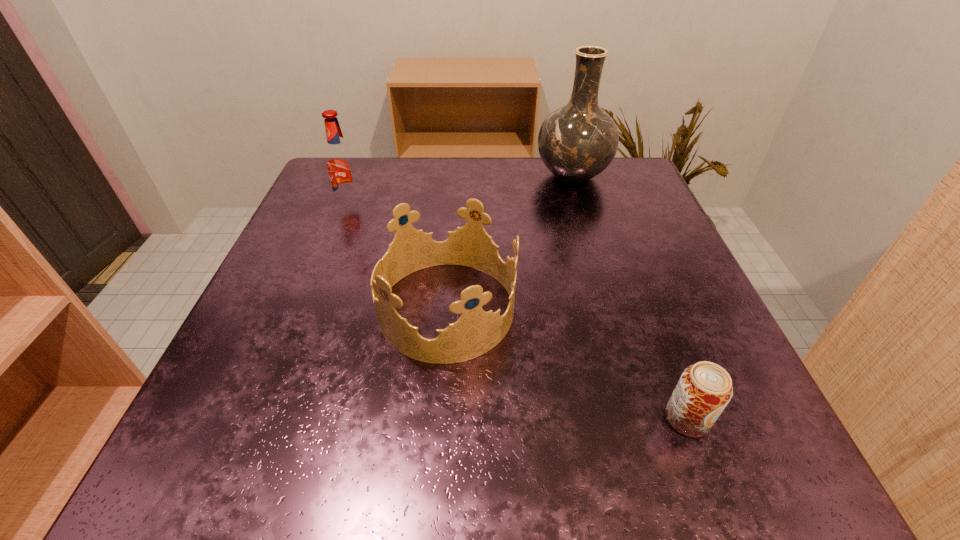
Where is `the farthest object`? The image size is (960, 540). the farthest object is located at coordinates (578, 141).

Where is `vase`? This screenshot has height=540, width=960. vase is located at coordinates (578, 141).

Identify the location of the second tallest object. The image size is (960, 540). (340, 162).

You are a GUI agent. You are given a task and a screenshot of the screen. Output one action in this format:
    pyautogui.click(x=<x>, y=<y>)
    Task: Click on the root beer
    
    Given the screenshot: What is the action you would take?
    pyautogui.click(x=340, y=162)

Locate an element on the screen. The width and height of the screenshot is (960, 540). the second object from left to right is located at coordinates (476, 332).

You are a GUI agent. You are given a task and a screenshot of the screen. Output one action in this format:
    pyautogui.click(x=<x>, y=<y>)
    Task: Click on the third farthest object
    The image size is (960, 540).
    Given the screenshot: What is the action you would take?
    pyautogui.click(x=476, y=332)

Find the location of a particular element. the shortest object is located at coordinates (704, 389).

Find the location of a particular element. This screenshot has width=960, height=540. the nearest object is located at coordinates (704, 389).

This screenshot has width=960, height=540. Identify the location of free space located on the front of the farthest object. (614, 318).

You are a GUI agent. You are given a task and a screenshot of the screen. Output one action in this format:
    pyautogui.click(x=<x>, y=<y>)
    Task: Click on the vacant space located on the front of the second tallest object
    
    Given the screenshot: What is the action you would take?
    (322, 282)